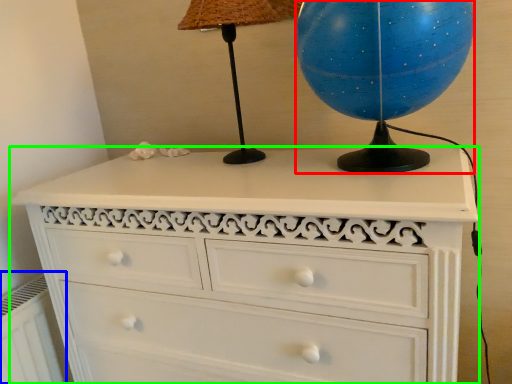
Question: Based on their relative distances, which object is farther from sphere (highlighted by a red box)? Choose from radiator (highlighted by a blue box) and chest of drawers (highlighted by a green box).

Choices:
 (A) radiator
 (B) chest of drawers

Answer: (A)